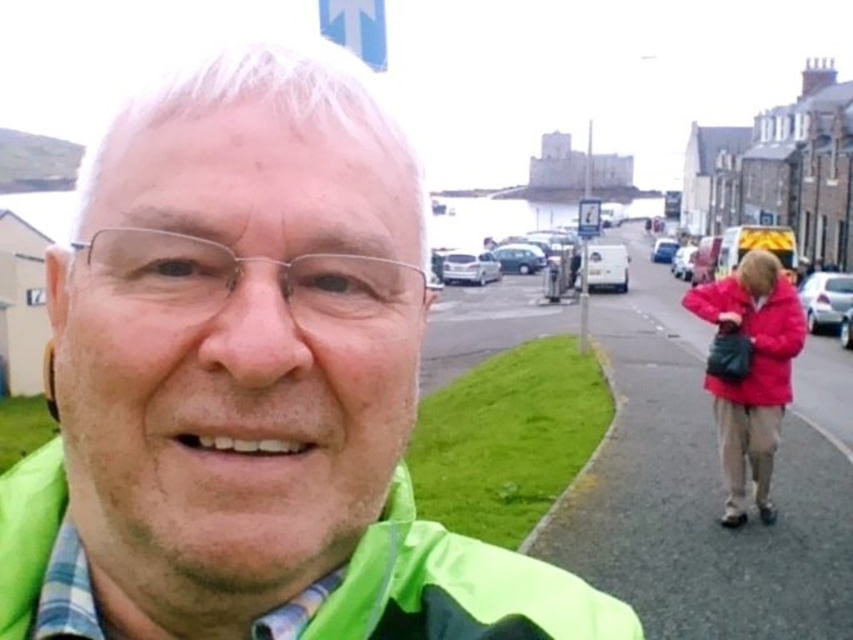
Question: Which object is closer to the camera taking this photo?

Choices:
 (A) matte red jacket at lower right
 (B) green fabric jacket at center

Answer: (B)

Question: Is green fabric jacket at center above green fabric jacket at lower left?

Choices:
 (A) yes
 (B) no

Answer: (A)

Question: Can you confirm if green fabric jacket at center is bigger than matte red jacket at lower right?

Choices:
 (A) no
 (B) yes

Answer: (A)

Question: Which object is the farthest from the matte red jacket at lower right?

Choices:
 (A) green fabric jacket at lower left
 (B) green fabric jacket at center

Answer: (B)

Question: Is green fabric jacket at center closer to the viewer compared to matte red jacket at lower right?

Choices:
 (A) no
 (B) yes

Answer: (B)

Question: Which of the following is the farthest from the observer?

Choices:
 (A) green fabric jacket at lower left
 (B) green fabric jacket at center
 (C) matte red jacket at lower right

Answer: (C)